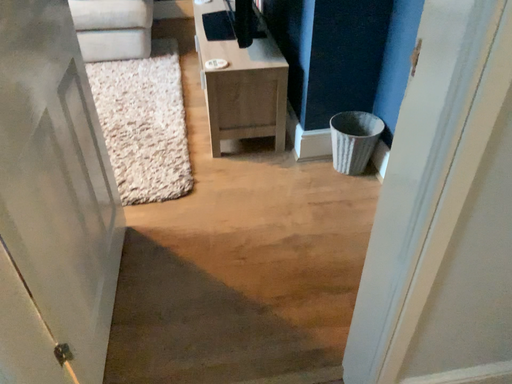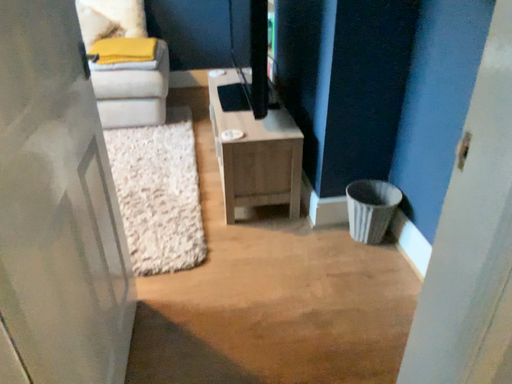
Question: How did the camera likely rotate when shooting the video?

Choices:
 (A) rotated downward
 (B) rotated upward

Answer: (B)